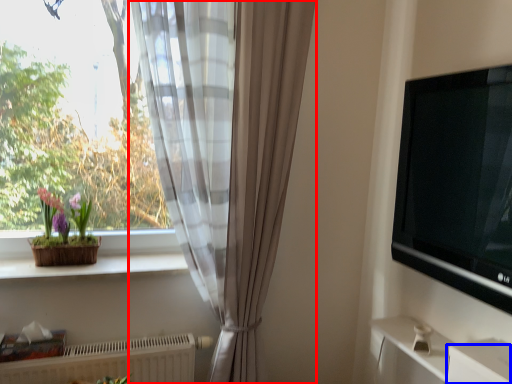
Question: Which of the following is the farthest to the observer, curtain (highlighted by a red box) or drawer (highlighted by a blue box)?

Choices:
 (A) curtain
 (B) drawer

Answer: (A)